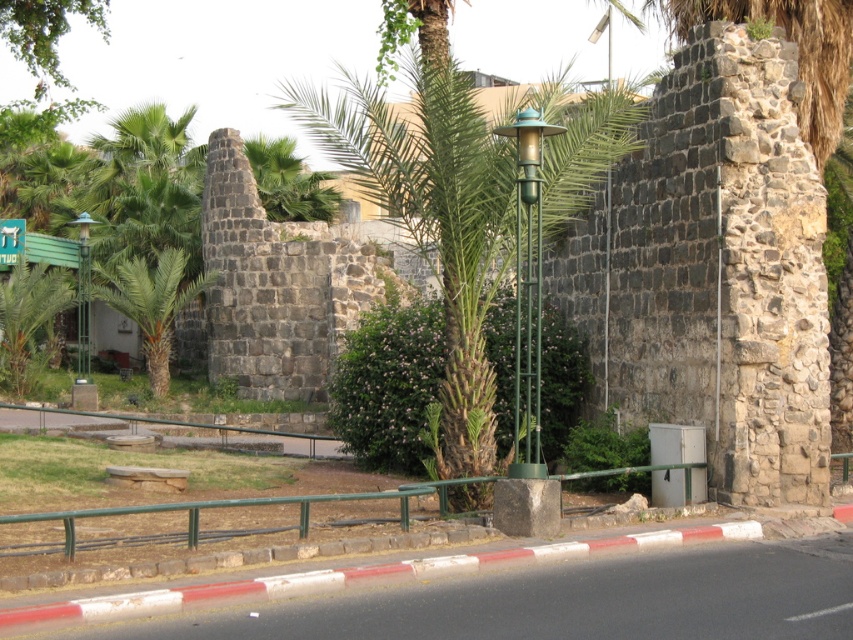
Question: Which point is closer to the camera taking this photo?

Choices:
 (A) (80, 243)
 (B) (44, 312)
 (C) (160, 396)

Answer: (B)

Question: Does green leafy palm tree at left appear under green plastic sign at upper left?

Choices:
 (A) no
 (B) yes

Answer: (B)

Question: Which object is farther from the camera taking this photo?

Choices:
 (A) green plastic sign at upper left
 (B) green metallic lamp post at left
 (C) green leafy palm tree at lower left

Answer: (B)

Question: Can you confirm if green matte lamp post at center is positioned to the right of green metallic lamp post at left?

Choices:
 (A) yes
 (B) no

Answer: (A)

Question: Which point is closer to the camera?

Choices:
 (A) green plastic sign at upper left
 (B) green leafy palm tree at center
 (C) green leafy palm tree at left

Answer: (B)

Question: Is the position of green leafy palm tree at center less distant than that of green metallic lamp post at left?

Choices:
 (A) no
 (B) yes

Answer: (B)